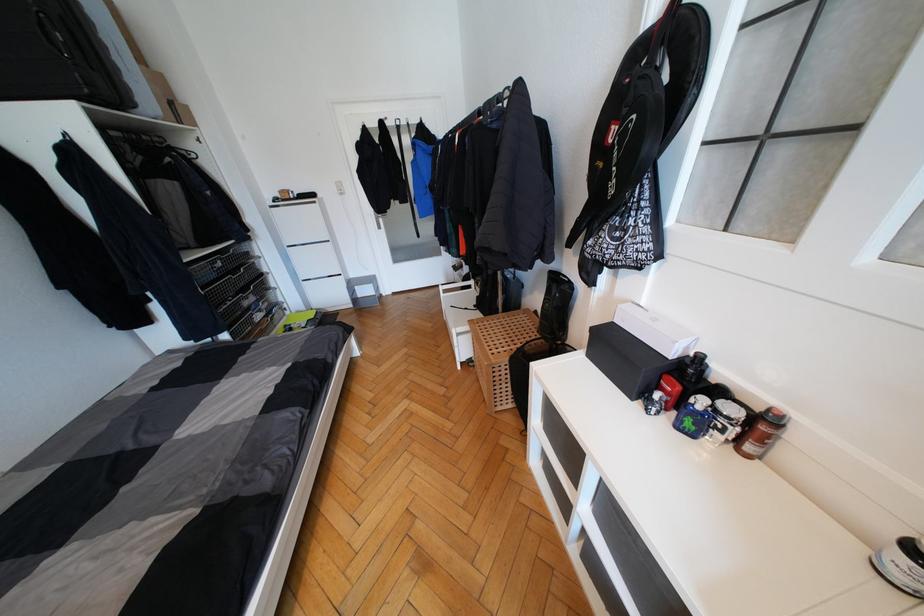
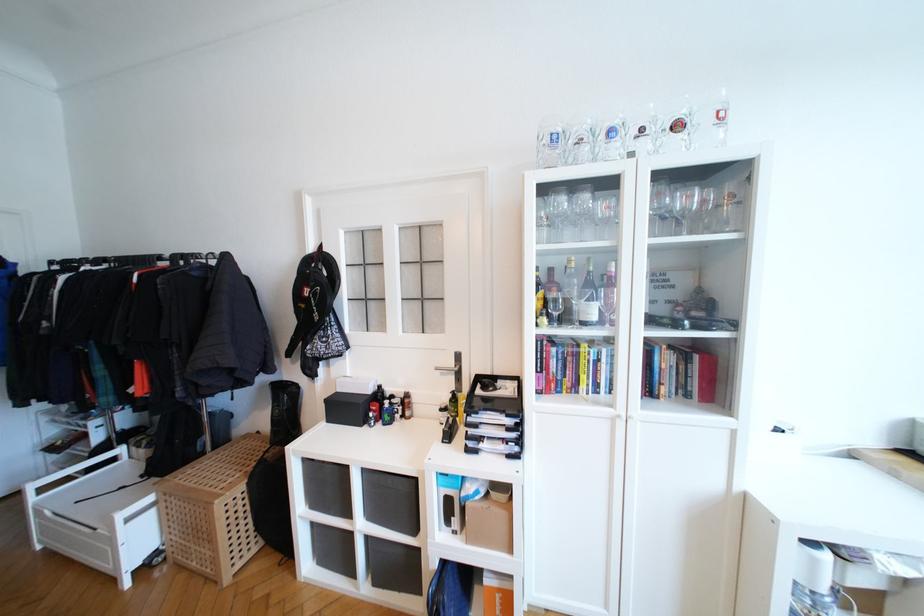
Find the pixel in the second image that matches (471,288) in the first image.

(116, 461)